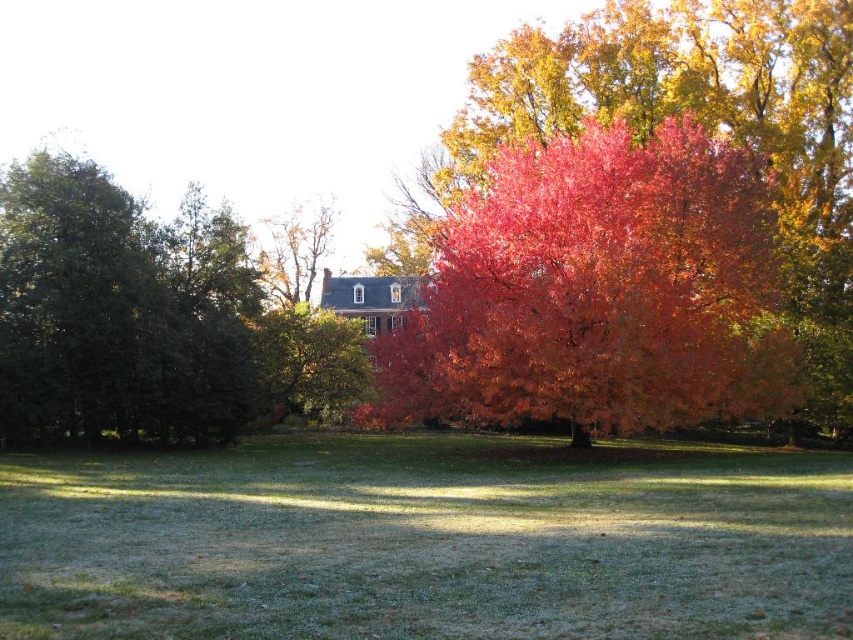
You are standing in the autumn scene described. You see the vivid red leaves at center and the green matte tree at left. Which object is positioned to the right of the other?

The vivid red leaves at center are positioned to the right of the green matte tree at left.

You are standing at the point with coordinates point (x=503, y=472) and want to walk towards the house. Will you pass by point (x=207, y=384) along the way?

Since point (x=503, y=472) is in front of point (x=207, y=384), walking towards the house from point (x=503, y=472) would mean moving away from point (x=207, y=384). Therefore, you will not pass by point (x=207, y=384) on your way to the house.